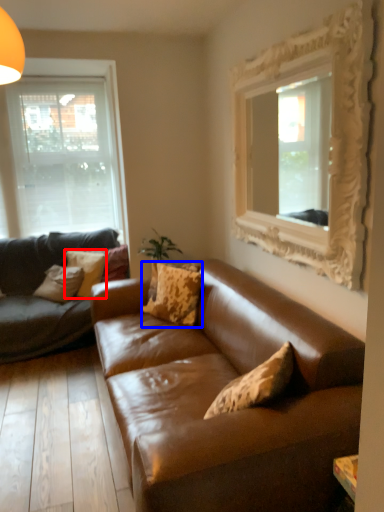
Question: Which of the following is the closest to the observer, pillow (highlighted by a red box) or pillow (highlighted by a blue box)?

Choices:
 (A) pillow
 (B) pillow

Answer: (B)